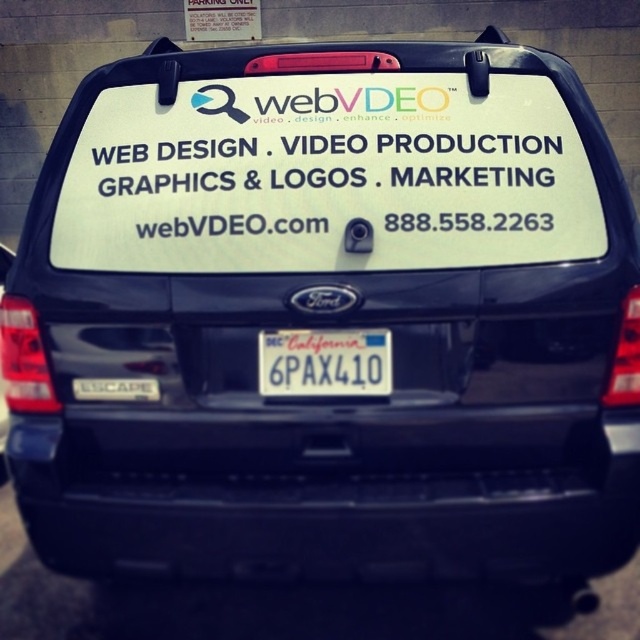
Question: Which object is the closest to the white plastic license plate at center?

Choices:
 (A) white paper sign at center
 (B) white plastic sign at upper center

Answer: (A)

Question: Which point is farther to the camera?

Choices:
 (A) white paper sign at center
 (B) white plastic sign at upper center
 (C) white plastic license plate at center

Answer: (B)

Question: Which point is farther from the camera taking this photo?

Choices:
 (A) (307, 376)
 (B) (227, 26)

Answer: (B)

Question: From the image, what is the correct spatial relationship of white paper sign at center in relation to white plastic sign at upper center?

Choices:
 (A) above
 (B) below

Answer: (B)

Question: Can you confirm if white paper sign at center is bigger than white plastic sign at upper center?

Choices:
 (A) no
 (B) yes

Answer: (B)

Question: Is the position of white paper sign at center less distant than that of white plastic license plate at center?

Choices:
 (A) no
 (B) yes

Answer: (B)